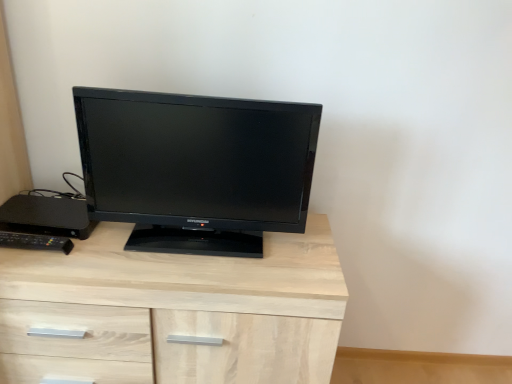
This screenshot has width=512, height=384. I want to click on vacant space in front of black plastic desktop at left, acting as the first desktop starting from the back, so click(47, 259).